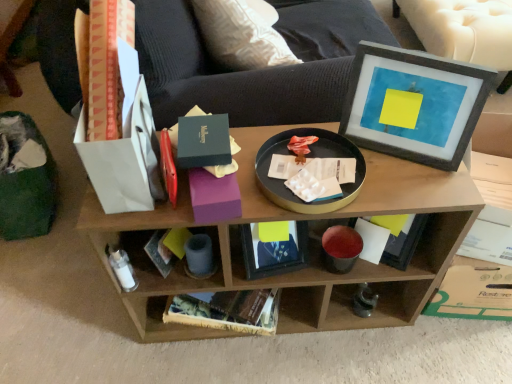
Question: Considering the positions of white paper book at lower center and matte gray picture frame at upper right in the image, is white paper book at lower center bigger or smaller than matte gray picture frame at upper right?

Choices:
 (A) small
 (B) big

Answer: (A)

Question: Is white paper book at lower center spatially inside matte gray picture frame at upper right, or outside of it?

Choices:
 (A) outside
 (B) inside

Answer: (A)

Question: Considering the real-world distances, which object is farthest from the white paper book at lower center?

Choices:
 (A) matte gray picture frame at upper right
 (B) wooden shelf at center
 (C) black matte tray at center

Answer: (A)

Question: Estimate the real-world distances between objects in this image. Which object is farther from the white paper book at lower center?

Choices:
 (A) matte gray picture frame at upper right
 (B) wooden shelf at center
 (C) black matte tray at center

Answer: (A)